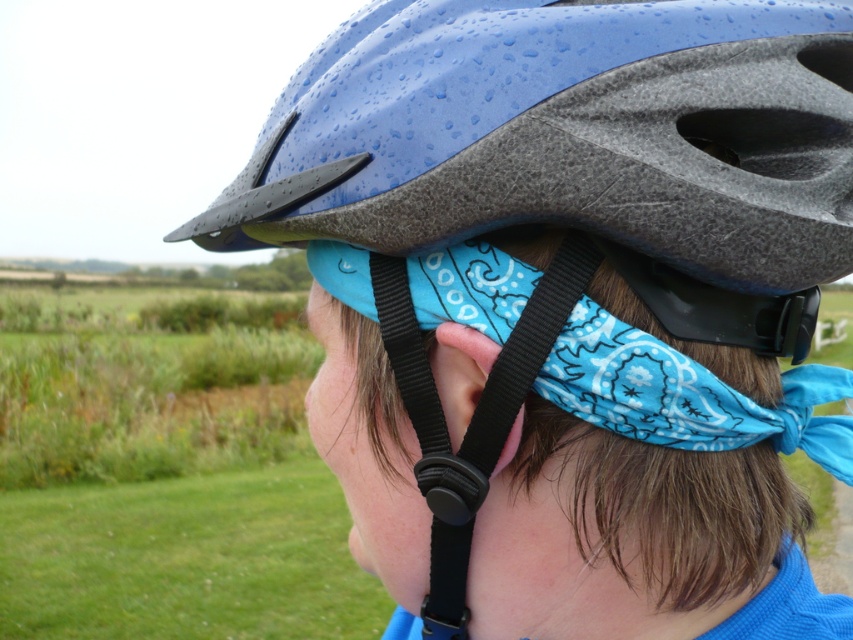
You are a drone operator trying to locate a specific object in an image. The scene shows a person in a blue bicycle helmet with black straps in a grassy field. You need to guide a drone to hover exactly above the blue matte helmet at center. What are the coordinates where the drone should be directed?

The drone should be directed to the coordinates point at (566, 134) to hover above the blue matte helmet at center.

You are a fashion designer analyzing the image. You need to determine which item is higher on the person wearing the blue bicycle helmet with black straps. Mention both the blue bandana at center and the pinksmoothear at center in your question.

The blue bandana at center is taller than the pinksmoothear at center, so the blue bandana at center is higher on the person wearing the blue bicycle helmet with black straps.

You are a photographer trying to capture a close shot of the blue matte helmet at center and the pinksmoothear at center. Since you want to focus on the helmet, which object should you adjust your camera focus on first?

The blue matte helmet at center is bigger than the pinksmoothear at center, so you should adjust your camera focus on the blue matte helmet at center first.